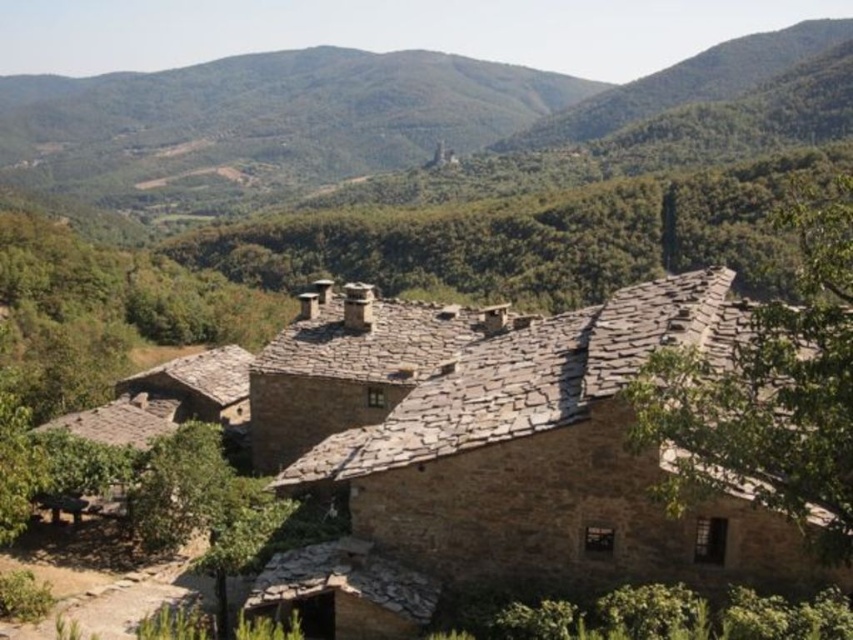
Question: Does green leafy forest at upper center have a larger size compared to green leafy tree at lower left?

Choices:
 (A) no
 (B) yes

Answer: (B)

Question: Which object is the farthest from the green leafy tree at upper right?

Choices:
 (A) green leafy tree at lower left
 (B) green leafy forest at upper center

Answer: (B)

Question: Which point is farther from the camera taking this photo?

Choices:
 (A) (202, 65)
 (B) (223, 614)
 (C) (822, 230)

Answer: (A)

Question: Is green leafy tree at upper right bigger than green leafy tree at lower left?

Choices:
 (A) yes
 (B) no

Answer: (A)

Question: Can you confirm if green leafy forest at upper center is positioned above green leafy tree at upper right?

Choices:
 (A) no
 (B) yes

Answer: (B)

Question: Based on their relative distances, which object is nearer to the green leafy tree at lower left?

Choices:
 (A) green leafy forest at upper center
 (B) green leafy tree at upper right

Answer: (B)